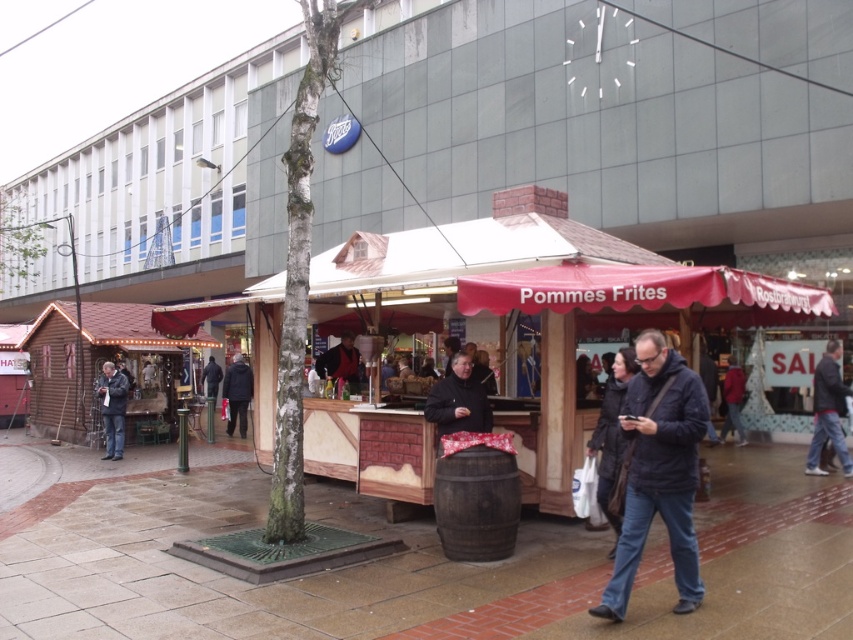
Question: Which of the following is the closest to the observer?

Choices:
 (A) dark blue jacket at center
 (B) black fabric jacket at center

Answer: (A)

Question: Among these objects, which one is nearest to the camera?

Choices:
 (A) pink fabric canopy at center
 (B) dark blue jacket at center
 (C) dark blue jeans at lower right

Answer: (B)

Question: Which point is farther to the camera?

Choices:
 (A) (840, 436)
 (B) (664, 483)
 (C) (106, 429)
 (D) (799, 284)

Answer: (C)

Question: Considering the relative positions of dark blue jeans at lower right and dark brown leather jacket at center in the image provided, where is dark blue jeans at lower right located with respect to dark brown leather jacket at center?

Choices:
 (A) above
 (B) below

Answer: (B)

Question: Can you confirm if black fabric jacket at center is positioned to the right of dark brown leather jacket at center?

Choices:
 (A) no
 (B) yes

Answer: (A)

Question: Is dark blue jacket at center to the left of black fabric jacket at center from the viewer's perspective?

Choices:
 (A) yes
 (B) no

Answer: (B)